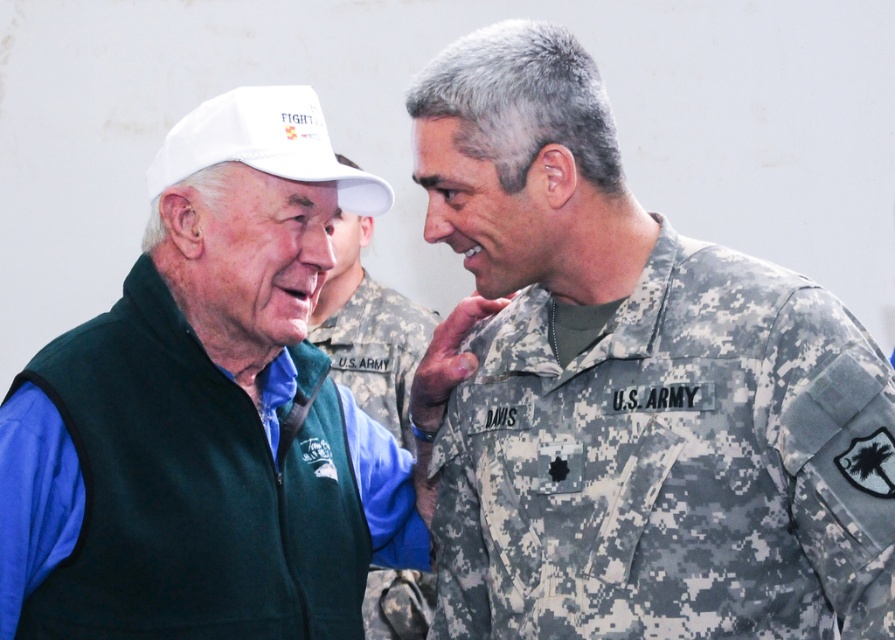
You are a photographer setting up for a group photo. You see the camouflage fabric us army uniform at center and the white matte baseball cap at upper left. Which object is positioned to the right side of the other?

The camouflage fabric us army uniform at center is to the right of the white matte baseball cap at upper left.

You are an event organizer who needs to hang two items on a wall for a display. The camouflage fabric us army uniform at center and the green fleece vest at left are to be displayed. Given their sizes, which item should be placed higher on the wall to ensure they are both visible?

The camouflage fabric us army uniform at center should be placed higher on the wall since it has a greater height compared to the green fleece vest at left, ensuring both items are visible.

You are a photographer setting up for a group photo. You need to position the camouflage fabric us army uniform at center and the white matte baseball cap at upper left so that both are clearly visible. Based on their current positions, which object is closer to the camera?

The camouflage fabric us army uniform at center is closer to the viewer than the white matte baseball cap at upper left, so the camouflage fabric us army uniform at center would appear larger in the photo.